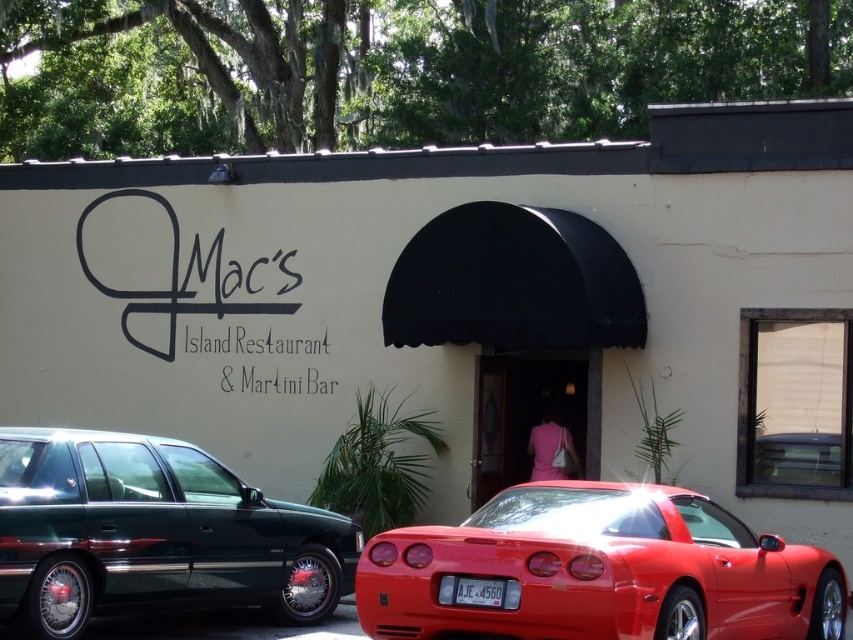
Question: Does shiny red sports car at lower right appear on the left side of white plastic license plate at center?

Choices:
 (A) yes
 (B) no

Answer: (B)

Question: Which object is the closest to the shiny dark green sedan at left?

Choices:
 (A) shiny red sports car at lower right
 (B) white plastic license plate at center

Answer: (A)

Question: Is shiny dark green sedan at left to the left of white plastic license plate at center from the viewer's perspective?

Choices:
 (A) yes
 (B) no

Answer: (A)

Question: Based on their relative distances, which object is farther from the white plastic license plate at center?

Choices:
 (A) shiny red sports car at lower right
 (B) shiny dark green sedan at left

Answer: (B)

Question: Which point is farther to the camera?

Choices:
 (A) shiny dark green sedan at left
 (B) shiny red sports car at lower right

Answer: (A)

Question: Is shiny dark green sedan at left smaller than white plastic license plate at center?

Choices:
 (A) no
 (B) yes

Answer: (A)